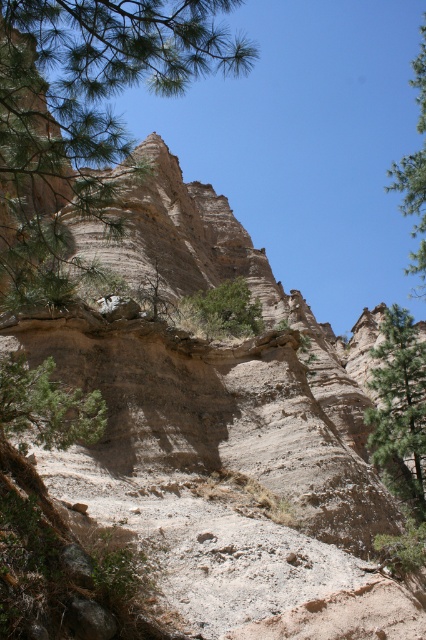
Question: Which point appears farthest from the camera in this image?

Choices:
 (A) (97, 400)
 (B) (400, 464)
 (C) (419, 243)

Answer: (C)

Question: Does green leafy tree at upper left appear on the right side of green leafy tree at upper right?

Choices:
 (A) no
 (B) yes

Answer: (A)

Question: Observing the image, what is the correct spatial positioning of green leafy tree at upper left in reference to green textured tree at lower left?

Choices:
 (A) left
 (B) right

Answer: (A)

Question: Which point is farther from the camera taking this photo?

Choices:
 (A) (397, 388)
 (B) (184, 314)

Answer: (B)

Question: Which point is closer to the camera taking this photo?

Choices:
 (A) (215, 326)
 (B) (138, 20)

Answer: (B)

Question: Does green leafy tree at upper left appear over green leafy tree at upper right?

Choices:
 (A) no
 (B) yes

Answer: (A)